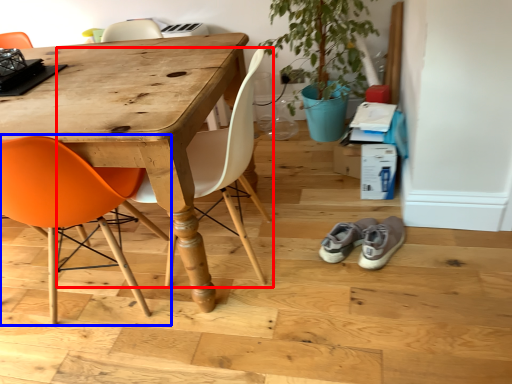
Question: Which object appears farthest to the camera in this image, chair (highlighted by a red box) or chair (highlighted by a blue box)?

Choices:
 (A) chair
 (B) chair

Answer: (A)